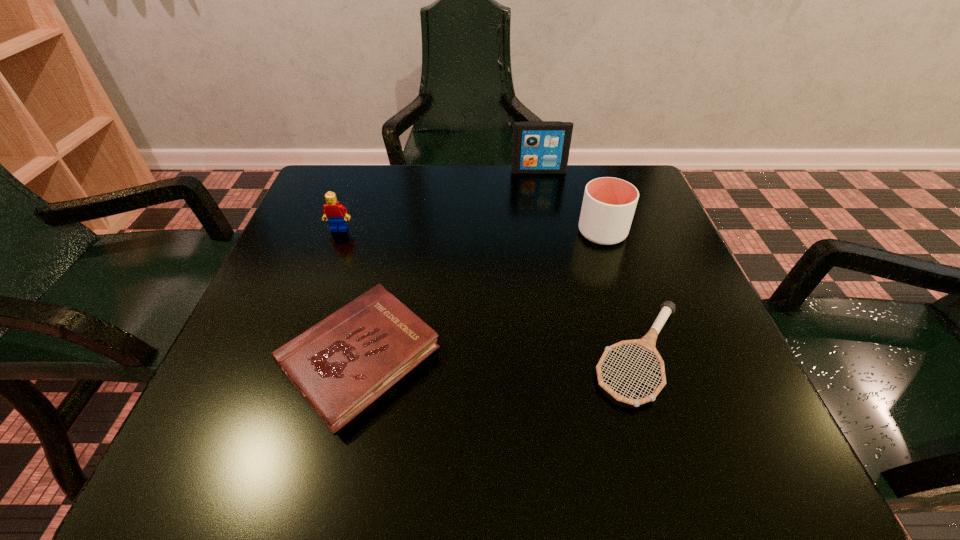
At what (x,y) coordinates should I click in order to perform the action: click on vacant space located on the back of the tennis racket. Please return your answer as a coordinate pair (x, y). Image resolution: width=960 pixels, height=540 pixels. Looking at the image, I should click on (591, 201).

The height and width of the screenshot is (540, 960). I want to click on iPod present at the far edge, so click(539, 147).

At what (x,y) coordinates should I click in order to perform the action: click on cup located in the far edge section of the desktop. Please return your answer as a coordinate pair (x, y). The height and width of the screenshot is (540, 960). Looking at the image, I should click on (609, 204).

Locate an element on the screen. Image resolution: width=960 pixels, height=540 pixels. object that is at the near edge is located at coordinates (342, 364).

Image resolution: width=960 pixels, height=540 pixels. Find the location of `Lego present at the left edge`. Lego present at the left edge is located at coordinates (334, 212).

Locate an element on the screen. Image resolution: width=960 pixels, height=540 pixels. hardback book located at the left edge is located at coordinates (342, 364).

The image size is (960, 540). Identify the location of cup that is positioned at the right edge. tap(609, 204).

Where is `tennis racket situated at the right edge`? tennis racket situated at the right edge is located at coordinates (647, 342).

Locate an element on the screen. object at the near left corner is located at coordinates (342, 364).

The image size is (960, 540). I want to click on object that is at the far right corner, so click(x=609, y=204).